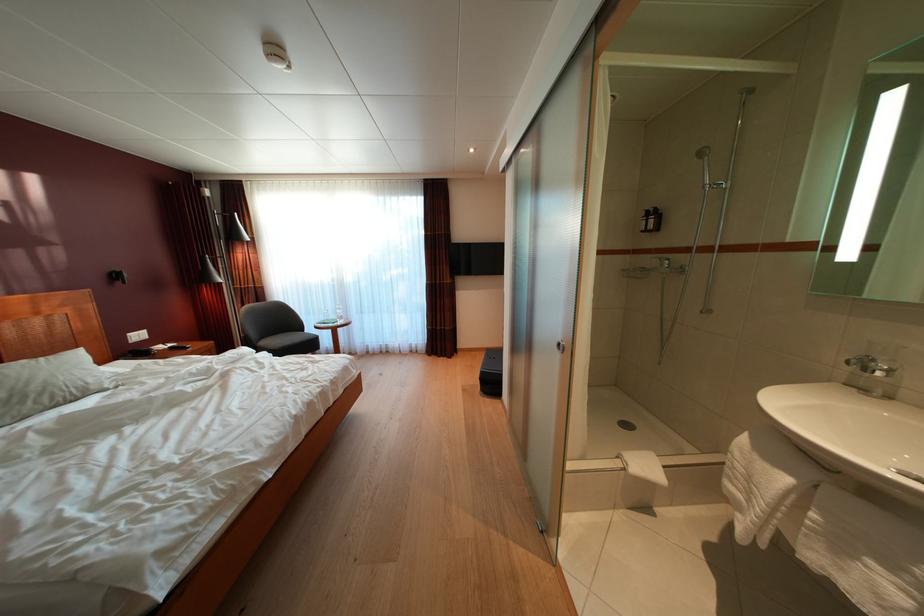
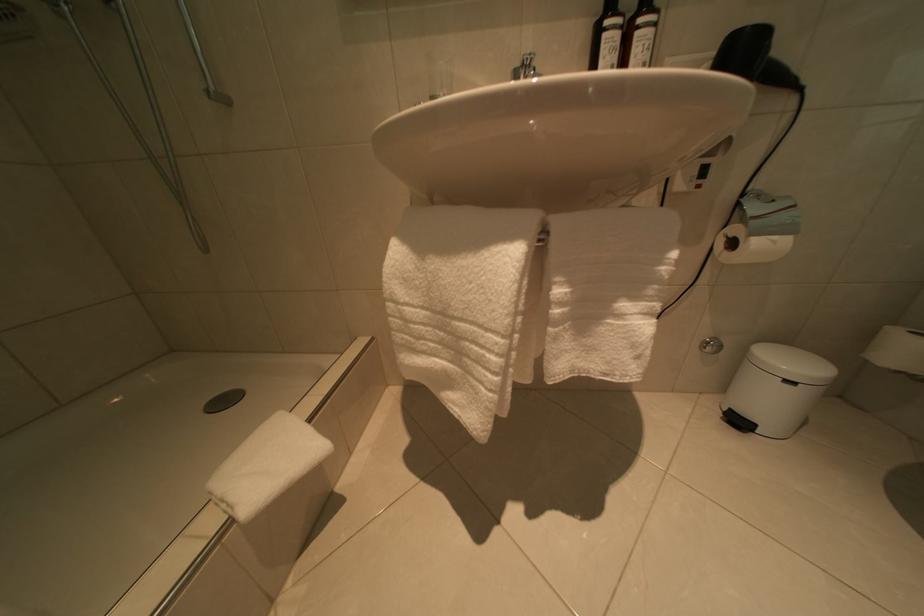
The point at (794, 485) is marked in the first image. Where is the corresponding point in the second image?

(517, 262)